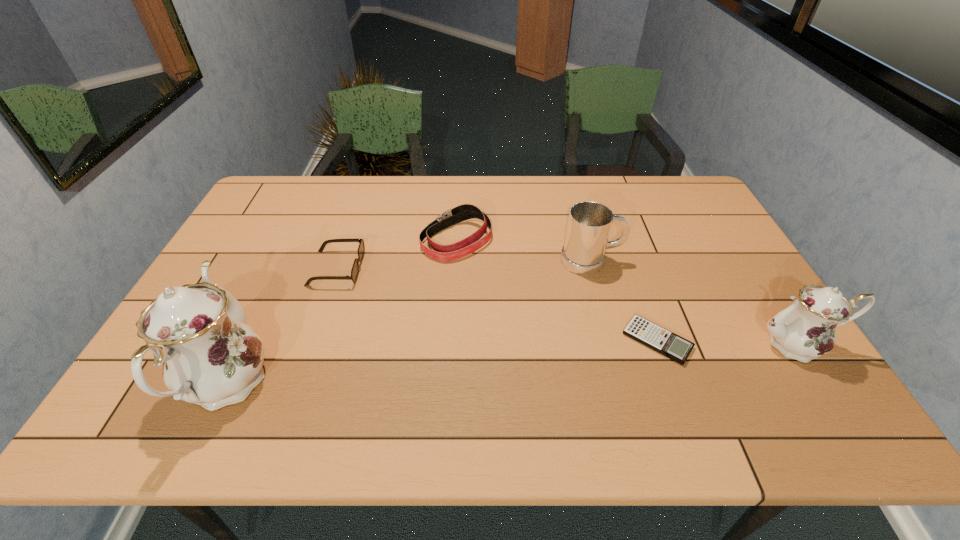
Locate an element on the screen. The image size is (960, 540). the tallest object is located at coordinates (211, 357).

The width and height of the screenshot is (960, 540). What are the coordinates of `the taller chinaware` in the screenshot? It's located at (211, 357).

Identify the location of the shorter chinaware. Image resolution: width=960 pixels, height=540 pixels. (805, 330).

Image resolution: width=960 pixels, height=540 pixels. Find the location of `the right chinaware`. the right chinaware is located at coordinates (805, 330).

Locate an element on the screen. mug is located at coordinates (589, 224).

I want to click on the fourth object from right to left, so coord(460,249).

Identify the location of dog collar. The image size is (960, 540). (460, 249).

This screenshot has height=540, width=960. Find the location of `sunglasses`. sunglasses is located at coordinates (361, 249).

Where is `the shortest object`? the shortest object is located at coordinates (657, 338).

Locate an element on the screen. free space located on the back of the taller chinaware is located at coordinates (283, 263).